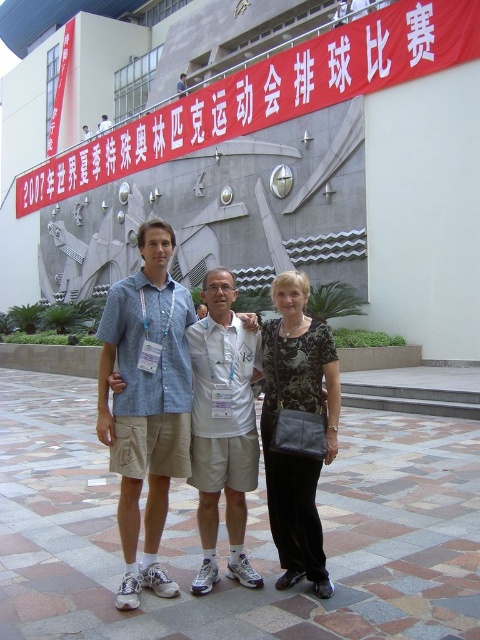
From the picture: Does white cotton shirt at center appear on the right side of white paper banner at upper center?

Correct, you'll find white cotton shirt at center to the right of white paper banner at upper center.

Does white cotton shirt at center appear on the left side of white paper banner at upper center?

In fact, white cotton shirt at center is to the right of white paper banner at upper center.

This screenshot has height=640, width=480. Describe the element at coordinates (223, 426) in the screenshot. I see `white cotton shirt at center` at that location.

Find the location of a particular element. The height and width of the screenshot is (640, 480). white cotton shirt at center is located at coordinates (223, 426).

Is matte white shirt at center smaller than black textured dress at center?

Indeed, matte white shirt at center has a smaller size compared to black textured dress at center.

Which is below, matte white shirt at center or black textured dress at center?

matte white shirt at center is below.

Which is in front, point (302, 456) or point (276, 276)?

Point (302, 456)

Identify the location of matte white shirt at center. (262, 428).

Does matte white shirt at center have a greater width compared to white cotton shirt at center?

Correct, the width of matte white shirt at center exceeds that of white cotton shirt at center.

Between point (321, 353) and point (207, 276), which one is positioned in front?

Positioned in front is point (321, 353).

Is point (242, 550) behind point (197, 422)?

No, (242, 550) is closer to viewer.

Where is `matte white shirt at center`? Image resolution: width=480 pixels, height=640 pixels. matte white shirt at center is located at coordinates (262, 428).